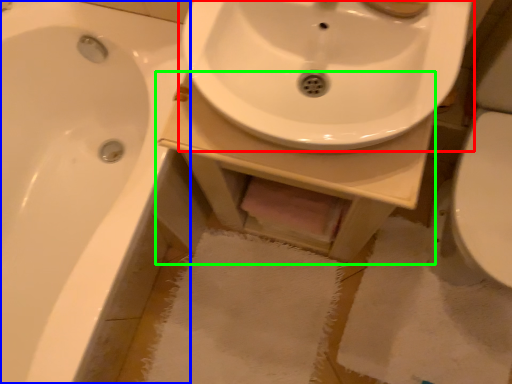
Question: Estimate the real-world distances between objects in this image. Which object is closer to sink (highlighted by a red box), bathtub (highlighted by a blue box) or counter top (highlighted by a green box)?

Choices:
 (A) bathtub
 (B) counter top

Answer: (B)